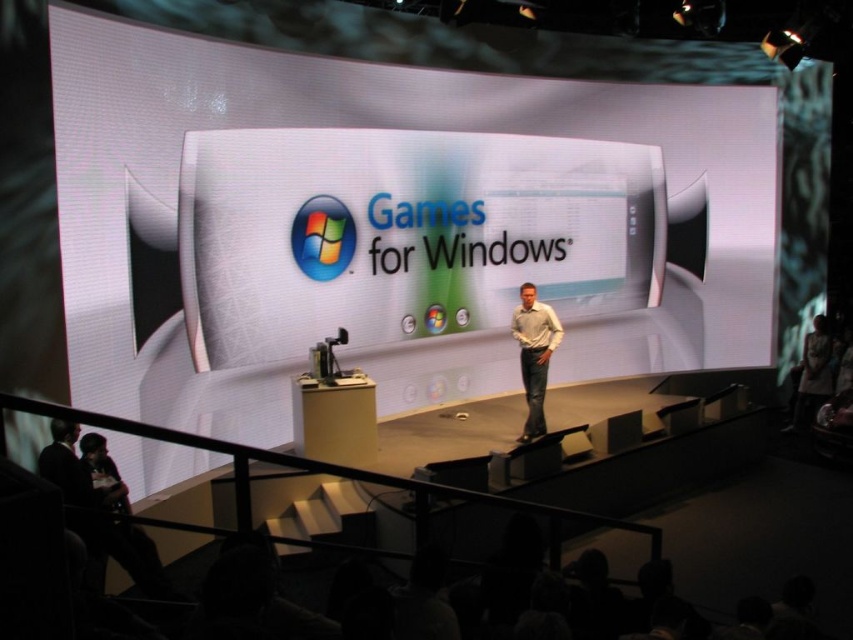
Question: Which is nearer to the light gray shirt at center?

Choices:
 (A) white glossy projection screen at center
 (B) light brown leather jacket at right

Answer: (A)

Question: Is white glossy projection screen at center behind light gray shirt at center?

Choices:
 (A) no
 (B) yes

Answer: (A)

Question: Which point appears farthest from the camera in this image?

Choices:
 (A) (231, 237)
 (B) (531, 317)
 (C) (830, 384)

Answer: (C)

Question: Is the position of white glossy projection screen at center less distant than that of light gray shirt at center?

Choices:
 (A) yes
 (B) no

Answer: (A)

Question: Is white glossy projection screen at center wider than light gray shirt at center?

Choices:
 (A) no
 (B) yes

Answer: (B)

Question: Which object is closer to the camera taking this photo?

Choices:
 (A) white glossy projection screen at center
 (B) light brown leather jacket at right
 (C) light gray shirt at center

Answer: (A)